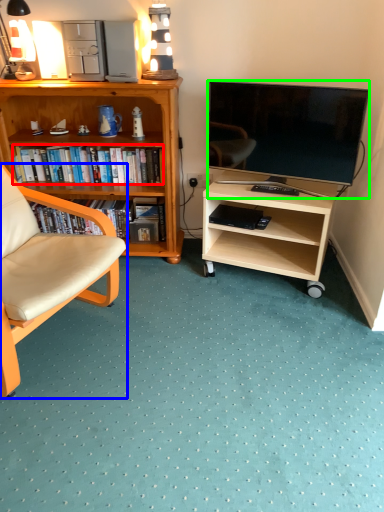
Question: Which object is positioned closest to book (highlighted by a red box)? Select from chair (highlighted by a blue box) and television (highlighted by a green box).

Choices:
 (A) chair
 (B) television

Answer: (B)